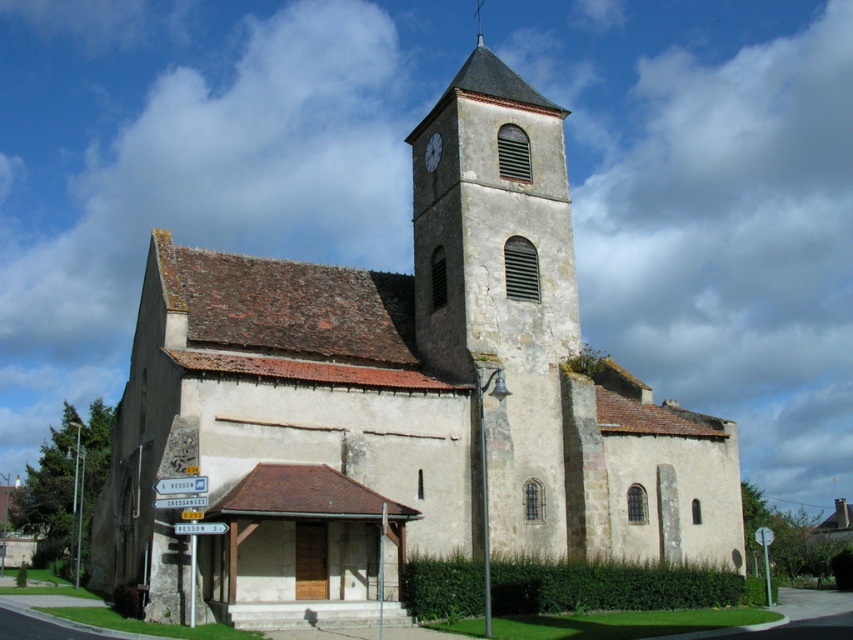
Is stone clock tower at center thinner than smooth gray spire at upper center?

No.

Is stone clock tower at center positioned at the back of smooth gray spire at upper center?

No, it is in front of smooth gray spire at upper center.

This screenshot has width=853, height=640. In order to click on stone clock tower at center in this screenshot , I will do `click(498, 289)`.

Identify the location of stone clock tower at center. (498, 289).

Who is more forward, (x=583, y=531) or (x=424, y=164)?

Positioned in front is point (x=583, y=531).

Is point (498, 106) less distant than point (440, 152)?

No, it is behind (440, 152).

This screenshot has height=640, width=853. I want to click on stone clock tower at center, so click(498, 289).

Can you confirm if white textured clock at upper center is positioned to the right of smooth gray spire at upper center?

No, white textured clock at upper center is not to the right of smooth gray spire at upper center.

Can you confirm if white textured clock at upper center is smaller than smooth gray spire at upper center?

Indeed, white textured clock at upper center has a smaller size compared to smooth gray spire at upper center.

Measure the distance between point (434, 168) and camera.

59.82 meters

Find the location of a particular element. This screenshot has height=640, width=853. white textured clock at upper center is located at coordinates (432, 150).